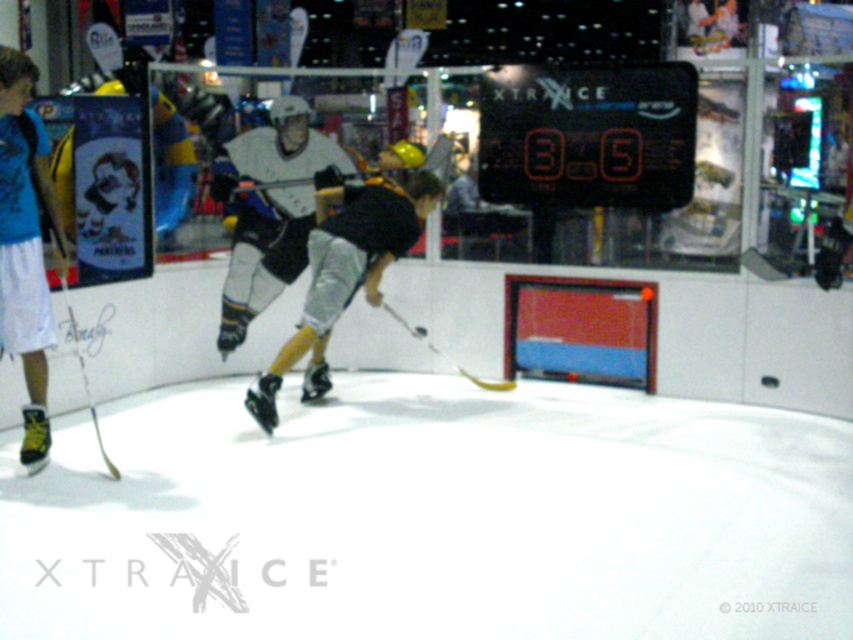
Question: From the image, what is the correct spatial relationship of black plastic scoreboard at upper center in relation to black matte hockey stick at center?

Choices:
 (A) right
 (B) left

Answer: (A)

Question: Which of the following is the farthest from the observer?

Choices:
 (A) (280, 577)
 (B) (318, 282)
 (C) (260, 163)
 (D) (613, 138)

Answer: (C)

Question: Where is white matte hockey stick at center located in relation to yellow matte hockey stick at center in the image?

Choices:
 (A) left
 (B) right

Answer: (A)

Question: Can you confirm if white smooth ice at center is positioned to the left of black matte hockey stick at center?

Choices:
 (A) no
 (B) yes

Answer: (A)

Question: Which point appears closest to the camera in this image?

Choices:
 (A) (585, 186)
 (B) (44, 140)

Answer: (B)

Question: Which point appears closest to the camera in this image?

Choices:
 (A) (213, 173)
 (B) (659, 616)
 (C) (668, 182)

Answer: (B)